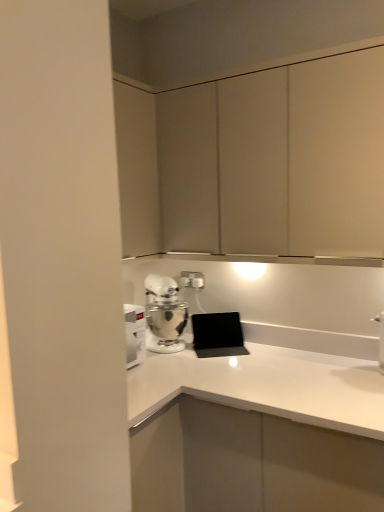
Question: Is matte white cabinet at upper center facing away from white plastic electric outlet at center?

Choices:
 (A) yes
 (B) no

Answer: (B)

Question: Is there a large distance between matte white cabinet at upper center and white plastic electric outlet at center?

Choices:
 (A) yes
 (B) no

Answer: (B)

Question: Can you confirm if matte white cabinet at upper center is taller than white plastic electric outlet at center?

Choices:
 (A) no
 (B) yes

Answer: (B)

Question: Is matte white cabinet at upper center thinner than white plastic electric outlet at center?

Choices:
 (A) no
 (B) yes

Answer: (A)

Question: Is matte white cabinet at upper center closer to camera compared to white plastic electric outlet at center?

Choices:
 (A) no
 (B) yes

Answer: (B)

Question: In the image, is white metallic stand mixer at lower left on the left side or the right side of white plastic electric outlet at center?

Choices:
 (A) left
 (B) right

Answer: (A)

Question: Is white metallic stand mixer at lower left taller or shorter than white plastic electric outlet at center?

Choices:
 (A) tall
 (B) short

Answer: (A)

Question: From a real-world perspective, is white metallic stand mixer at lower left above or below white plastic electric outlet at center?

Choices:
 (A) below
 (B) above

Answer: (A)

Question: From the image's perspective, is white metallic stand mixer at lower left located above or below white plastic electric outlet at center?

Choices:
 (A) below
 (B) above

Answer: (A)

Question: From the image's perspective, is white metallic stand mixer at lower left above or below matte white cabinet at upper center?

Choices:
 (A) below
 (B) above

Answer: (A)

Question: Is point (162, 315) closer or farther from the camera than point (198, 162)?

Choices:
 (A) closer
 (B) farther

Answer: (B)

Question: From their relative heights in the image, would you say white metallic stand mixer at lower left is taller or shorter than matte white cabinet at upper center?

Choices:
 (A) tall
 (B) short

Answer: (B)

Question: Is white metallic stand mixer at lower left wider or thinner than matte white cabinet at upper center?

Choices:
 (A) wide
 (B) thin

Answer: (B)

Question: From their relative heights in the image, would you say matte white cabinet at upper center is taller or shorter than white metallic stand mixer at lower left?

Choices:
 (A) short
 (B) tall

Answer: (B)

Question: Is matte white cabinet at upper center situated inside white metallic stand mixer at lower left or outside?

Choices:
 (A) outside
 (B) inside

Answer: (A)